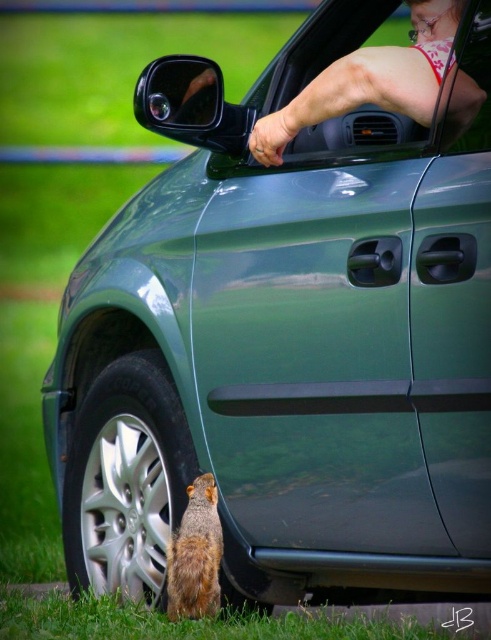
Who is shorter, matte pink skin at upper right or brown fur squirrel at lower left?

brown fur squirrel at lower left is shorter.

Which is behind, point (452, 4) or point (196, 584)?

The point (196, 584) is more distant.

This screenshot has width=491, height=640. I want to click on matte pink skin at upper right, so click(383, 84).

The width and height of the screenshot is (491, 640). Find the location of `matte pink skin at upper right`. matte pink skin at upper right is located at coordinates (383, 84).